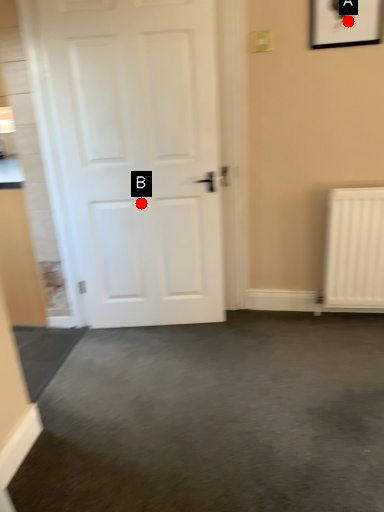
Question: Two points are circled on the image, labeled by A and B beside each circle. Which point is farther from the camera taking this photo?

Choices:
 (A) A is further
 (B) B is further

Answer: (B)